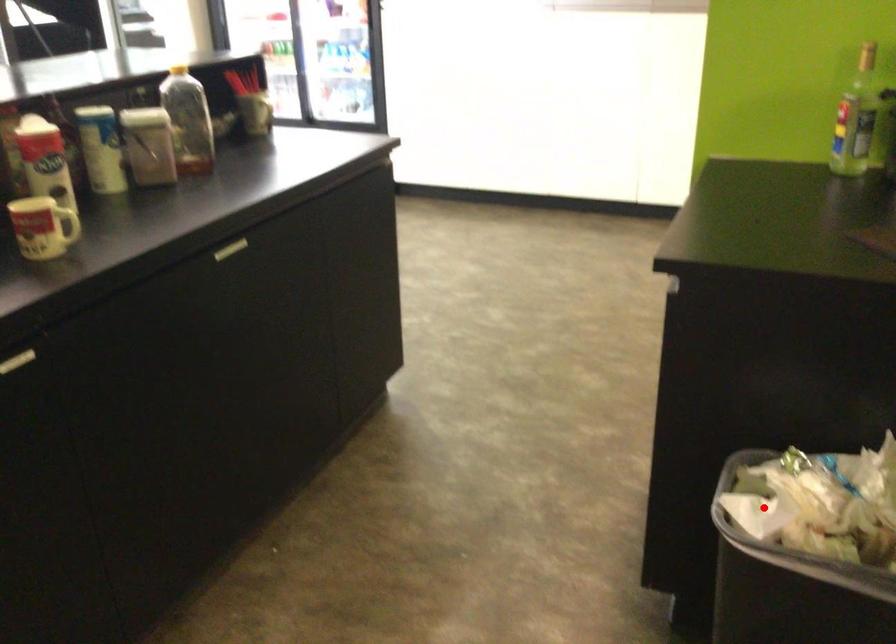
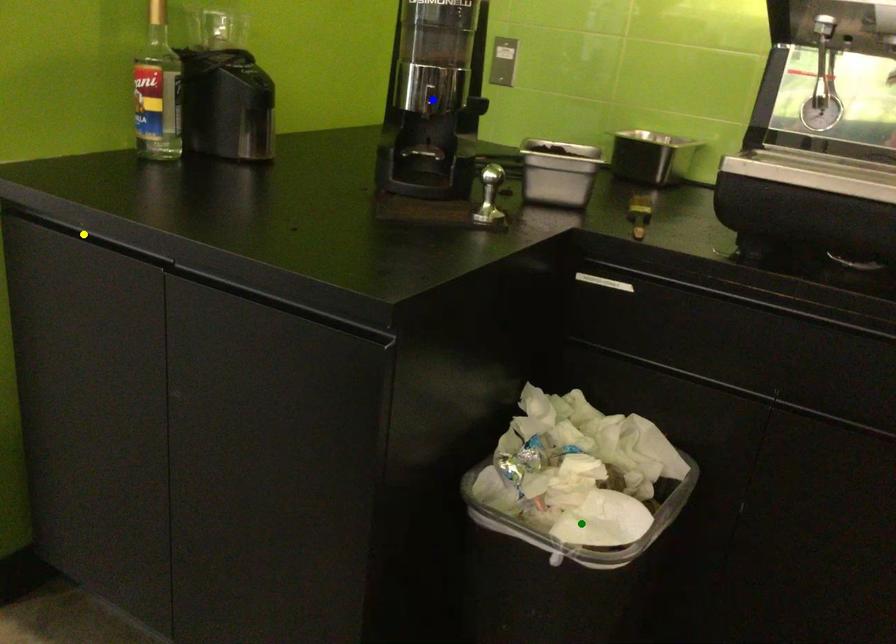
Question: I am providing you with two images of the same scene from different viewpoints. A red point is marked on the first image. You are given multiple points on the second image. Which spot in image 2 lines up with the point in image 1?

Choices:
 (A) green point
 (B) blue point
 (C) yellow point

Answer: (A)